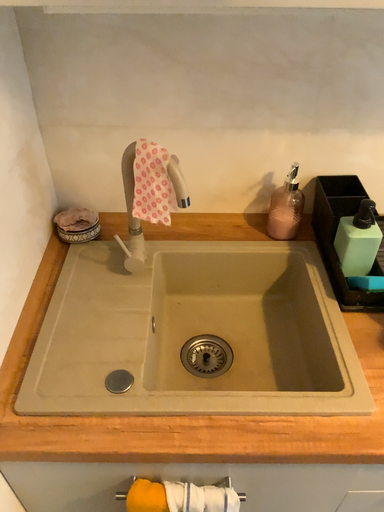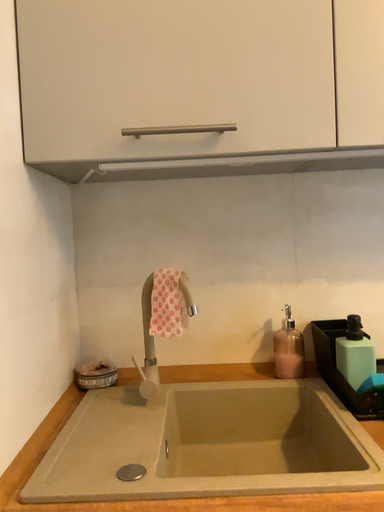
Question: How did the camera likely rotate when shooting the video?

Choices:
 (A) rotated downward
 (B) rotated upward

Answer: (B)